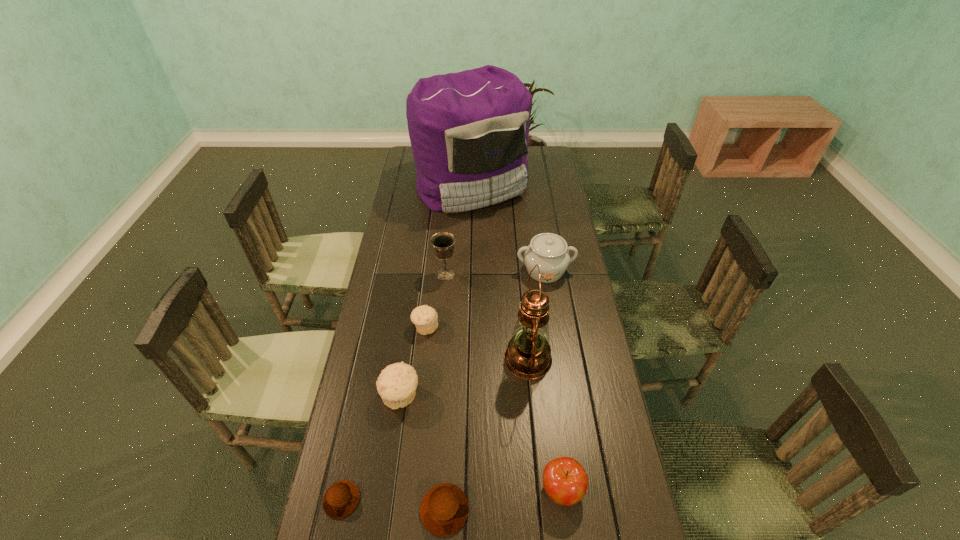
Find the location of a particular element. The image size is (960, 540). object positioned at the far right corner is located at coordinates (469, 131).

Image resolution: width=960 pixels, height=540 pixels. What are the coordinates of `vacant space at the left edge of the desktop` in the screenshot? It's located at (352, 412).

You are a GUI agent. You are given a task and a screenshot of the screen. Output one action in this format:
    pyautogui.click(x=<x>, y=<y>)
    Task: Click on the free location at the right edge
    This screenshot has width=960, height=540.
    Given the screenshot: What is the action you would take?
    pyautogui.click(x=556, y=186)

This screenshot has height=540, width=960. What are the coordinates of `blank region between the backpack and the shortest object` in the screenshot? It's located at (407, 342).

At what (x,y) coordinates should I click in order to perform the action: click on unoccupied position between the chinaware and the tallest object. Please return your answer as a coordinate pair (x, y). This screenshot has height=540, width=960. Looking at the image, I should click on (509, 228).

Identify the location of free area in between the chalice and the apple. The height and width of the screenshot is (540, 960). (504, 382).

Find the location of `empty location between the chalice and the purple backpack`. empty location between the chalice and the purple backpack is located at coordinates (459, 230).

At what (x,y) coordinates should I click in order to perform the action: click on free space between the second tallest object and the apple. Please return your answer as a coordinate pair (x, y). Image resolution: width=960 pixels, height=540 pixels. Looking at the image, I should click on (545, 424).

This screenshot has height=540, width=960. I want to click on vacant area that lies between the right brown muffin and the chalice, so click(445, 392).

Identify the location of unoccupied area between the chalice and the third tallest muffin. This screenshot has height=540, width=960. (445, 392).